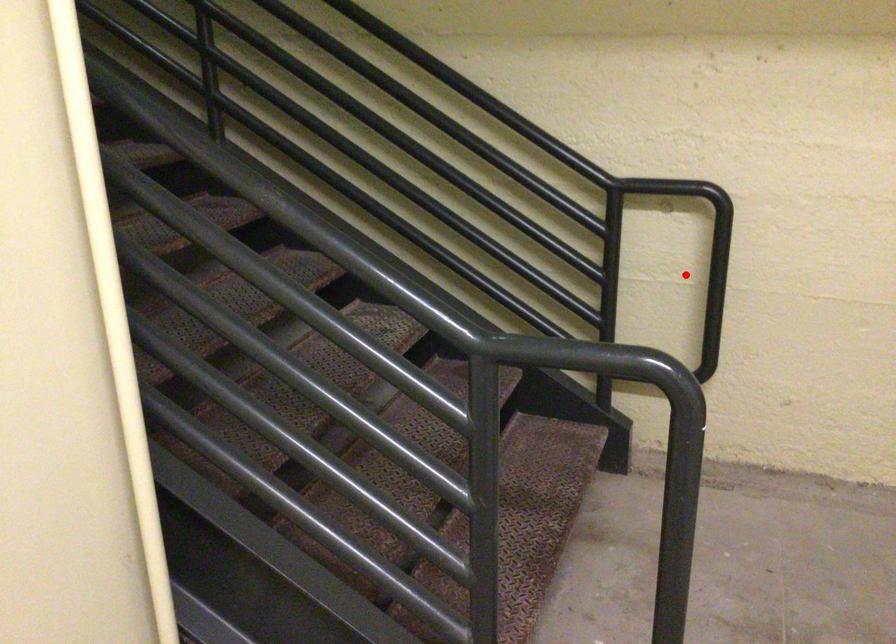
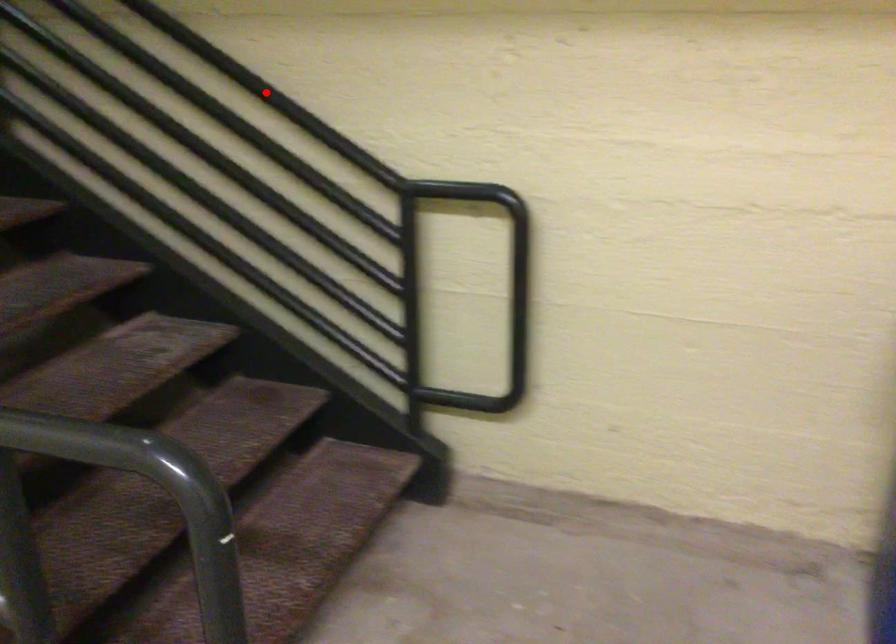
I am providing you with two images of the same scene from different viewpoints. A red point is marked on the first image and another point is marked on the second image. Is the marked point in image1 the same physical position as the marked point in image2?

No